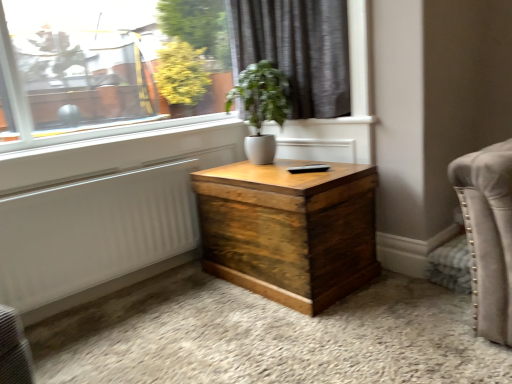
Question: Is dark grey fabric curtain at upper center at the left side of white textured radiator at lower left?

Choices:
 (A) no
 (B) yes

Answer: (A)

Question: Is white textured radiator at lower left at the back of dark grey fabric curtain at upper center?

Choices:
 (A) yes
 (B) no

Answer: (B)

Question: Considering the relative sizes of dark grey fabric curtain at upper center and white textured radiator at lower left in the image provided, is dark grey fabric curtain at upper center wider than white textured radiator at lower left?

Choices:
 (A) yes
 (B) no

Answer: (A)

Question: Considering the relative sizes of dark grey fabric curtain at upper center and white textured radiator at lower left in the image provided, is dark grey fabric curtain at upper center shorter than white textured radiator at lower left?

Choices:
 (A) no
 (B) yes

Answer: (A)

Question: From a real-world perspective, is dark grey fabric curtain at upper center on white textured radiator at lower left?

Choices:
 (A) yes
 (B) no

Answer: (A)

Question: From a real-world perspective, is dark grey fabric curtain at upper center above or below white smooth window sill at upper center?

Choices:
 (A) below
 (B) above

Answer: (B)

Question: Considering the positions of dark grey fabric curtain at upper center and white smooth window sill at upper center in the image, is dark grey fabric curtain at upper center wider or thinner than white smooth window sill at upper center?

Choices:
 (A) thin
 (B) wide

Answer: (A)

Question: Considering their positions, is dark grey fabric curtain at upper center located in front of or behind white smooth window sill at upper center?

Choices:
 (A) front
 (B) behind

Answer: (B)

Question: Based on their positions, is dark grey fabric curtain at upper center located to the left or right of white smooth window sill at upper center?

Choices:
 (A) left
 (B) right

Answer: (B)

Question: From a real-world perspective, is white textured radiator at lower left physically located above or below white smooth window sill at upper center?

Choices:
 (A) above
 (B) below

Answer: (B)

Question: Relative to white smooth window sill at upper center, is white textured radiator at lower left in front or behind?

Choices:
 (A) behind
 (B) front

Answer: (B)

Question: In terms of size, does white textured radiator at lower left appear bigger or smaller than white smooth window sill at upper center?

Choices:
 (A) small
 (B) big

Answer: (B)

Question: In terms of width, does white textured radiator at lower left look wider or thinner when compared to white smooth window sill at upper center?

Choices:
 (A) thin
 (B) wide

Answer: (A)

Question: Considering the positions of point (178, 122) and point (281, 125), is point (178, 122) closer or farther from the camera than point (281, 125)?

Choices:
 (A) closer
 (B) farther

Answer: (B)

Question: Is white smooth window sill at upper center bigger or smaller than white glossy vase at center?

Choices:
 (A) small
 (B) big

Answer: (A)